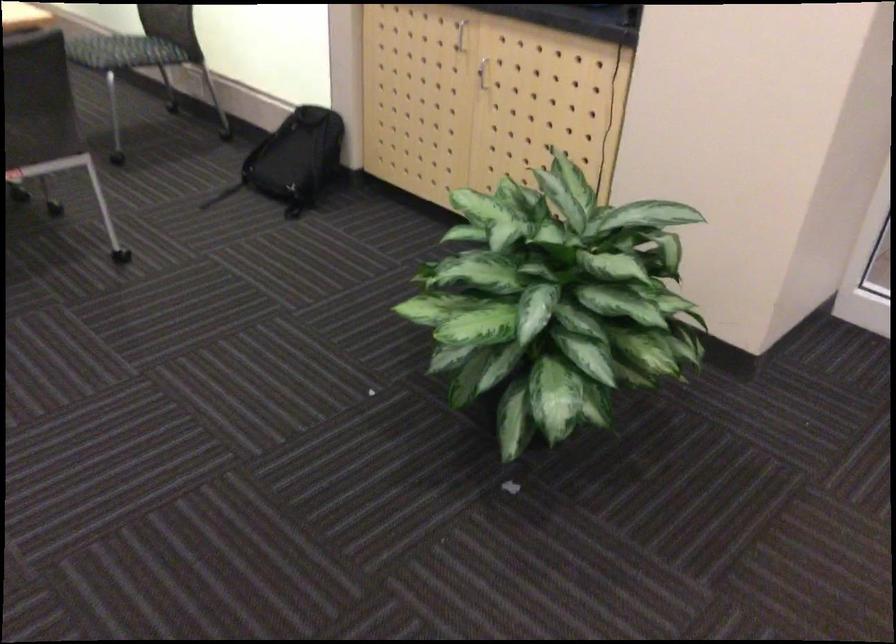
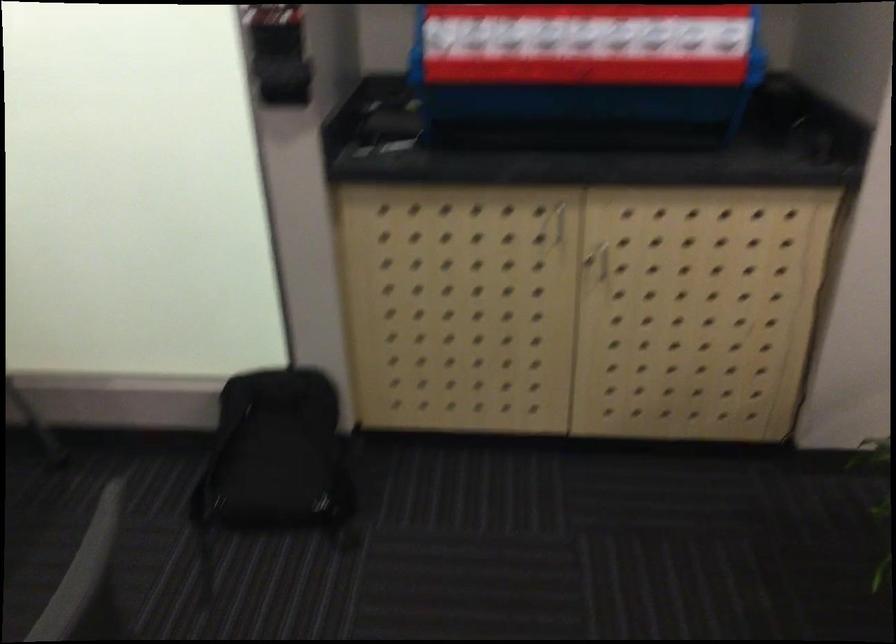
Find the pixel in the second image that matches pixel 476 73 in the first image.

(604, 261)